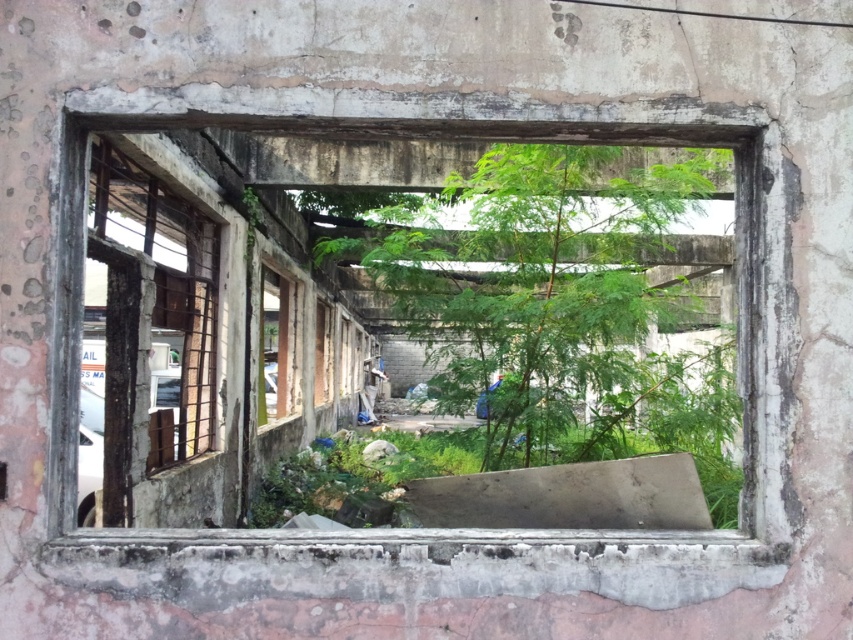
Question: Which of the following is the farthest from the observer?

Choices:
 (A) (554, 348)
 (B) (602, 490)

Answer: (A)

Question: Can you confirm if rusty concrete window frame at center is smaller than green leafy tree at center?

Choices:
 (A) yes
 (B) no

Answer: (B)

Question: Which point appears closest to the camera in this image?

Choices:
 (A) (454, 129)
 (B) (190, 401)

Answer: (A)

Question: Is green leafy tree at center positioned at the back of rusty metal window at left?

Choices:
 (A) yes
 (B) no

Answer: (B)

Question: Observing the image, what is the correct spatial positioning of green leafy tree at center in reference to rusty metal window at left?

Choices:
 (A) left
 (B) right

Answer: (B)

Question: Which is farther from the rusty concrete window frame at center?

Choices:
 (A) green leafy tree at center
 (B) rusty metal window at left

Answer: (B)